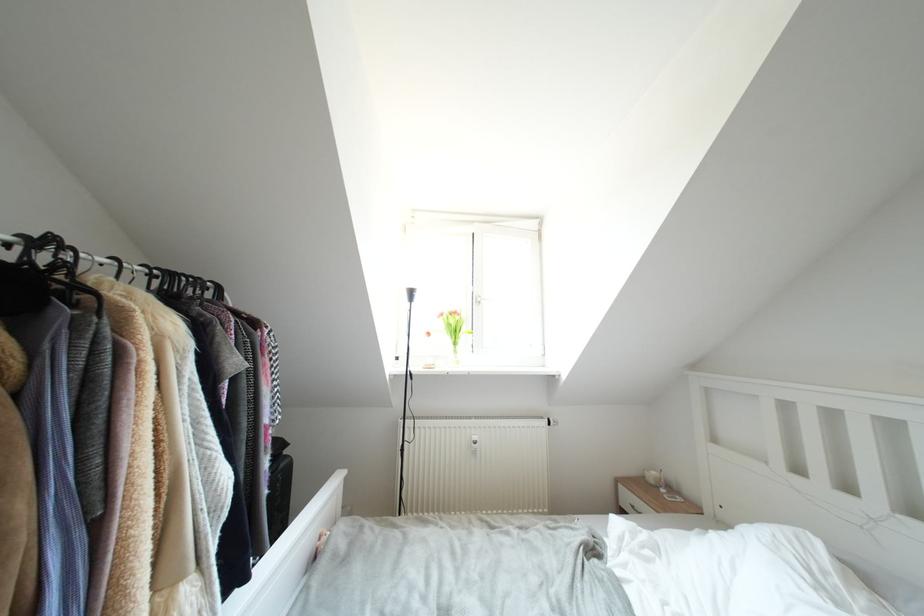
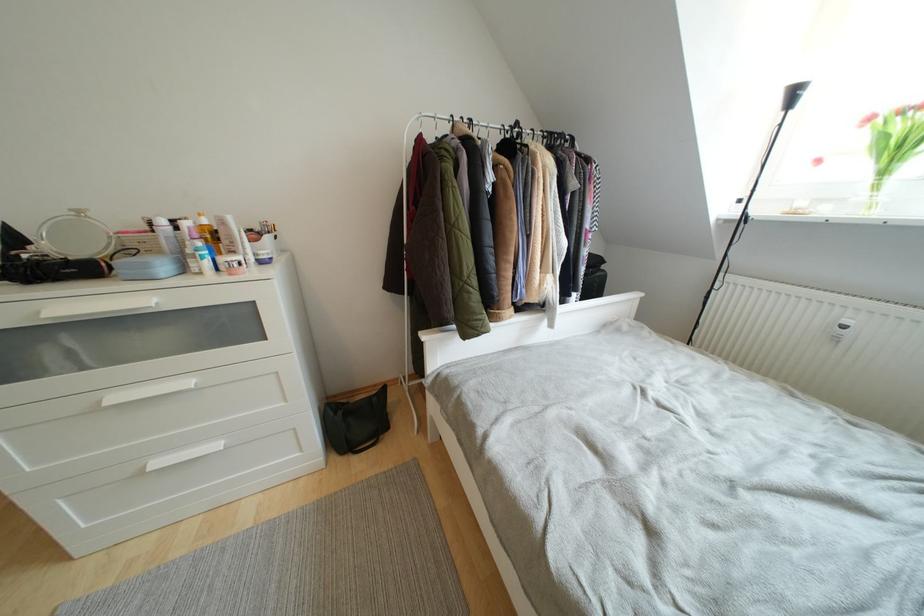
First-person continuous shooting, in which direction is the camera rotating?

The rotation direction of the camera is left-down.